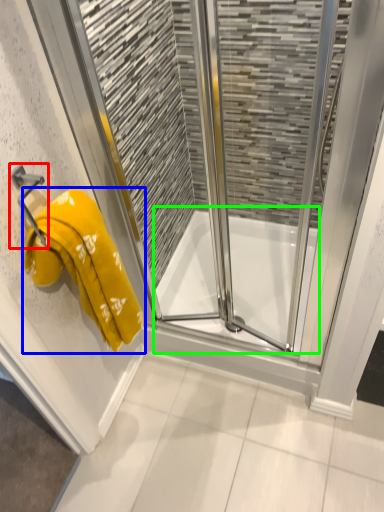
Question: Based on their relative distances, which object is nearer to towel bar (highlighted by a red box)? Choose from towel (highlighted by a blue box) and bath (highlighted by a green box).

Choices:
 (A) towel
 (B) bath

Answer: (A)